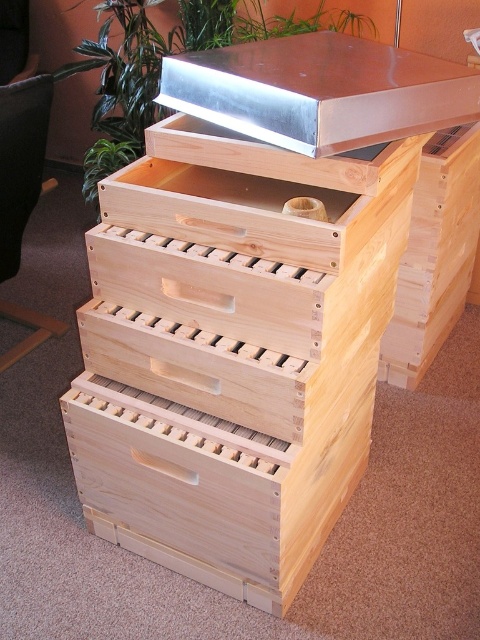
Question: In this image, where is natural wood crate at center located relative to metallic silver at upper center?

Choices:
 (A) above
 (B) below

Answer: (B)

Question: Is natural wood crate at center to the right of natural wood crate at right from the viewer's perspective?

Choices:
 (A) no
 (B) yes

Answer: (A)

Question: Estimate the real-world distances between objects in this image. Which object is closer to the natural wood crate at right?

Choices:
 (A) natural wood crate at center
 (B) metallic silver at upper center

Answer: (B)

Question: Can you confirm if natural wood crate at center is thinner than metallic silver at upper center?

Choices:
 (A) no
 (B) yes

Answer: (A)

Question: Among these points, which one is farthest from the camera?

Choices:
 (A) (462, 132)
 (B) (195, 52)

Answer: (A)

Question: Which point is closer to the camera taking this photo?

Choices:
 (A) (443, 234)
 (B) (229, 97)

Answer: (B)